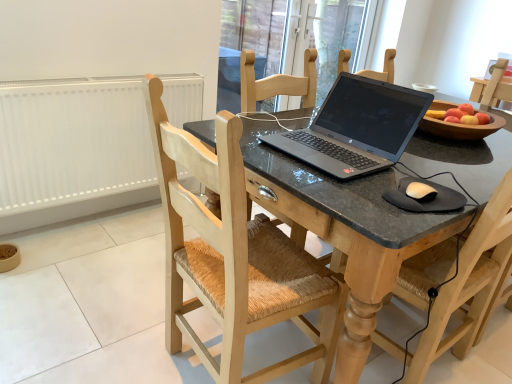
Question: Is wooden woven seat at center, the 1th chair in the right-to-left sequence, facing away from black rubber mousepad at lower right?

Choices:
 (A) yes
 (B) no

Answer: (B)

Question: Is wooden woven seat at center, the 1th chair in the right-to-left sequence, closer to camera compared to black rubber mousepad at lower right?

Choices:
 (A) no
 (B) yes

Answer: (B)

Question: Can you confirm if wooden woven seat at center, which is the 2th chair in left-to-right order, is bigger than black rubber mousepad at lower right?

Choices:
 (A) yes
 (B) no

Answer: (A)

Question: Is wooden woven seat at center, the 1th chair in the right-to-left sequence, shorter than black rubber mousepad at lower right?

Choices:
 (A) no
 (B) yes

Answer: (A)

Question: Would you consider wooden woven seat at center, the 1th chair in the right-to-left sequence, to be distant from black rubber mousepad at lower right?

Choices:
 (A) no
 (B) yes

Answer: (A)

Question: From the image's perspective, is wooden woven seat at center, which is the 2th chair in left-to-right order, below black rubber mousepad at lower right?

Choices:
 (A) yes
 (B) no

Answer: (A)

Question: Is white matte radiator at left behind transparent glass door at upper center?

Choices:
 (A) no
 (B) yes

Answer: (A)

Question: From the image's perspective, is white matte radiator at left under transparent glass door at upper center?

Choices:
 (A) no
 (B) yes

Answer: (B)

Question: Is white matte radiator at left not within transparent glass door at upper center?

Choices:
 (A) no
 (B) yes

Answer: (B)

Question: Does white matte radiator at left have a smaller size compared to transparent glass door at upper center?

Choices:
 (A) yes
 (B) no

Answer: (A)

Question: From a real-world perspective, is white matte radiator at left located higher than transparent glass door at upper center?

Choices:
 (A) no
 (B) yes

Answer: (A)

Question: Can you confirm if white matte radiator at left is thinner than transparent glass door at upper center?

Choices:
 (A) yes
 (B) no

Answer: (B)

Question: Is matte black laptop at center next to light wood chair at center, positioned as the 1th chair in left-to-right order?

Choices:
 (A) no
 (B) yes

Answer: (A)